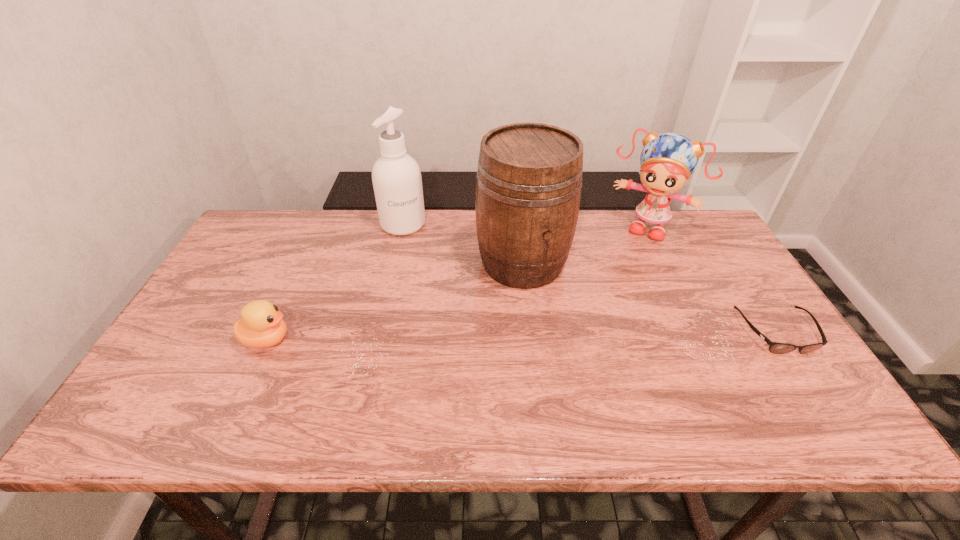
Identify the location of vacant space located 0.170m on the front label of the second object from left to right. (422, 269).

What are the coordinates of `vacant space located 0.360m on the front label of the second object from left to right` in the screenshot? It's located at (441, 313).

Where is `vacant space located on the front label of the second object from left to right`? The height and width of the screenshot is (540, 960). vacant space located on the front label of the second object from left to right is located at coordinates (428, 282).

Image resolution: width=960 pixels, height=540 pixels. Identify the location of vacant region located on the face of the doll. (615, 281).

Locate an element on the screen. free space located on the face of the doll is located at coordinates (622, 268).

At what (x,y) coordinates should I click in order to perform the action: click on vacant region located on the face of the doll. Please return your answer as a coordinate pair (x, y). Image resolution: width=960 pixels, height=540 pixels. Looking at the image, I should click on click(x=626, y=260).

Where is `cider situated at the far edge`? cider situated at the far edge is located at coordinates (529, 179).

You are a GUI agent. You are given a task and a screenshot of the screen. Output one action in this format:
    pyautogui.click(x=<x>, y=<y>)
    Task: Click on the cleansing agent positioned at the far edge
    
    Given the screenshot: What is the action you would take?
    coord(396,176)

This screenshot has height=540, width=960. Find the location of `doll at the far edge`. doll at the far edge is located at coordinates (667, 160).

Image resolution: width=960 pixels, height=540 pixels. I want to click on sunglasses present at the right edge, so click(777, 348).